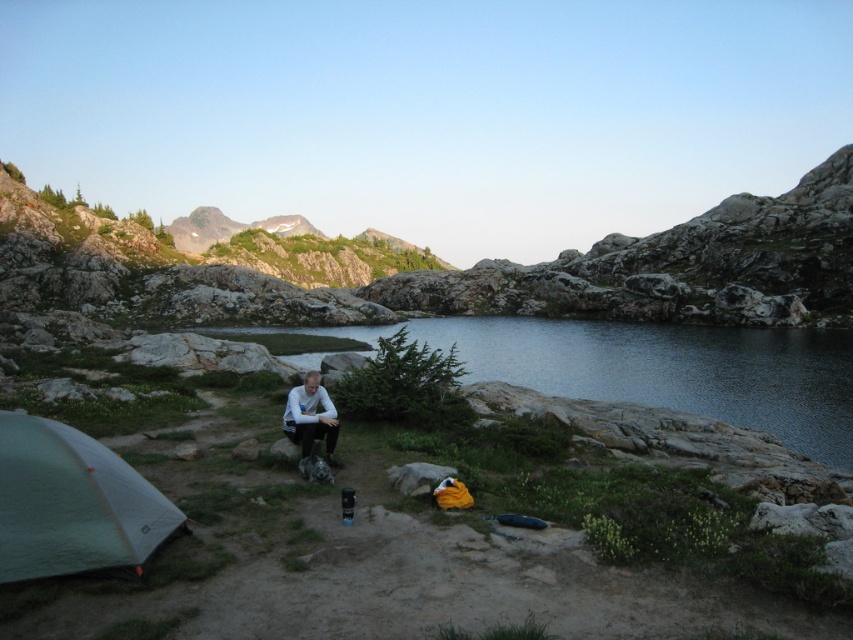
Consider the image. Can you confirm if green fabric tent at lower left is positioned to the left of white matte shirt at center?

Indeed, green fabric tent at lower left is positioned on the left side of white matte shirt at center.

What are the coordinates of `green fabric tent at lower left` in the screenshot? It's located at (71, 502).

Between point (68, 477) and point (318, 433), which one is positioned in front?

Point (68, 477) is in front.

At what (x,y) coordinates should I click in order to perform the action: click on green fabric tent at lower left. Please return your answer as a coordinate pair (x, y). Looking at the image, I should click on (71, 502).

Does clear water at center lie behind green fabric tent at lower left?

Yes, clear water at center is further from the viewer.

Locate an element on the screen. clear water at center is located at coordinates (656, 369).

Locate an element on the screen. clear water at center is located at coordinates (656, 369).

Does clear water at center have a lesser width compared to white matte shirt at center?

No, clear water at center is not thinner than white matte shirt at center.

Is clear water at center to the right of white matte shirt at center from the viewer's perspective?

Correct, you'll find clear water at center to the right of white matte shirt at center.

Locate an element on the screen. clear water at center is located at coordinates (656, 369).